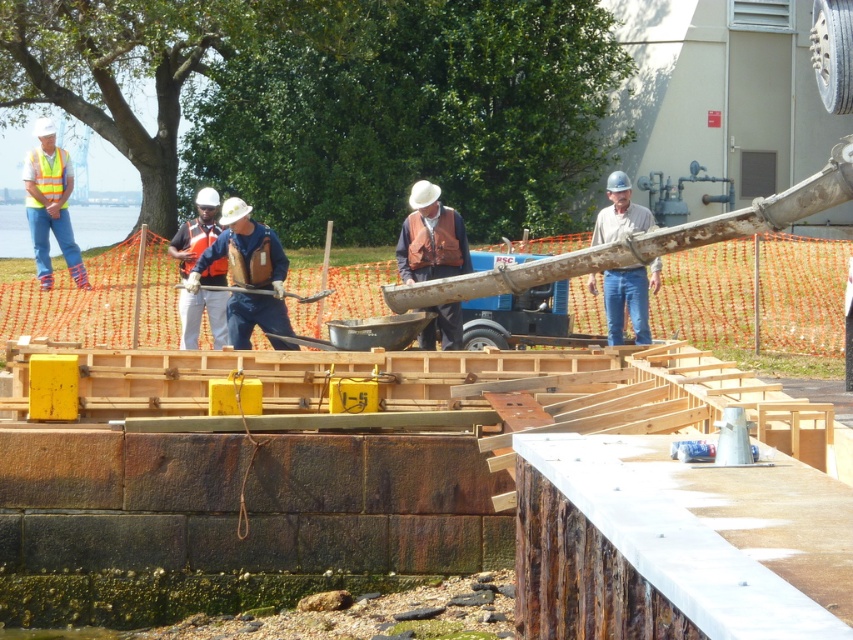
Question: Which point appears farthest from the camera in this image?

Choices:
 (A) (422, 339)
 (B) (53, 221)
 (C) (207, 272)
 (D) (35, 202)

Answer: (D)

Question: Where is high-visibility reflective vest at left located in relation to orange reflective vest at center in the image?

Choices:
 (A) right
 (B) left

Answer: (B)

Question: Which object is closer to the camera taking this photo?

Choices:
 (A) matte gray hard hat at center
 (B) high-visibility reflective vest at left
 (C) high-visibility fabric safety vest at left

Answer: (A)

Question: Among these points, which one is farthest from the camera?

Choices:
 (A) (648, 266)
 (B) (410, 202)
 (C) (196, 218)

Answer: (C)

Question: Can you confirm if wooden frame at center is bigger than orange reflective vest at center?

Choices:
 (A) yes
 (B) no

Answer: (A)

Question: Is wooden frame at center to the left of matte gray hard hat at center from the viewer's perspective?

Choices:
 (A) yes
 (B) no

Answer: (A)